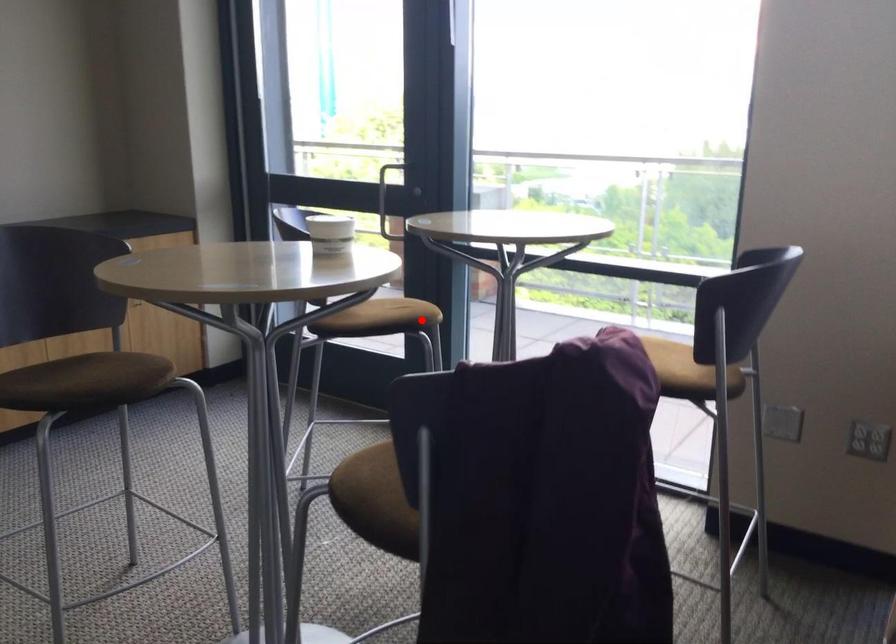
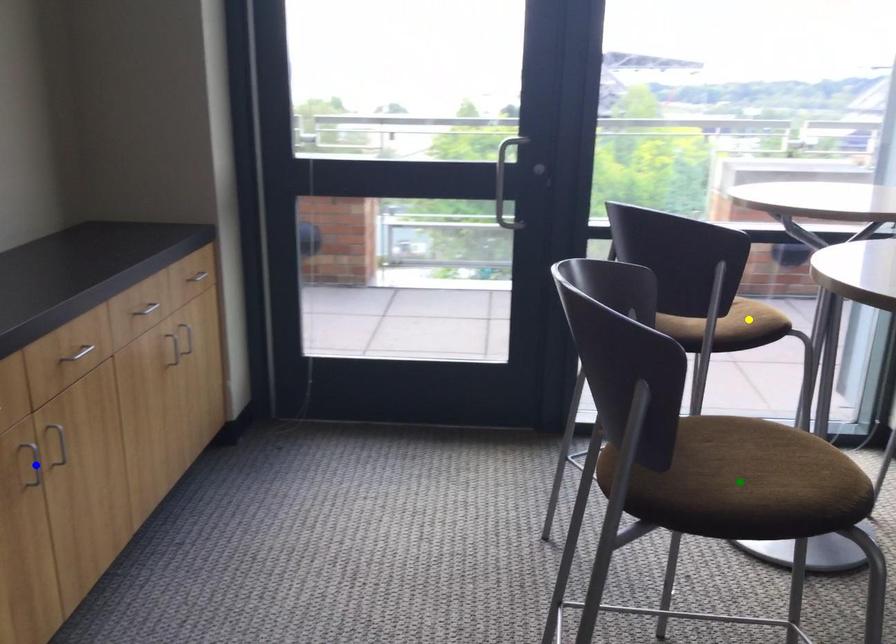
Question: I am providing you with two images of the same scene from different viewpoints. A red point is marked on the first image. You are given multiple points on the second image. In image 2, which mark is for the same physical point as the one in image 1?

Choices:
 (A) green point
 (B) blue point
 (C) yellow point

Answer: (C)